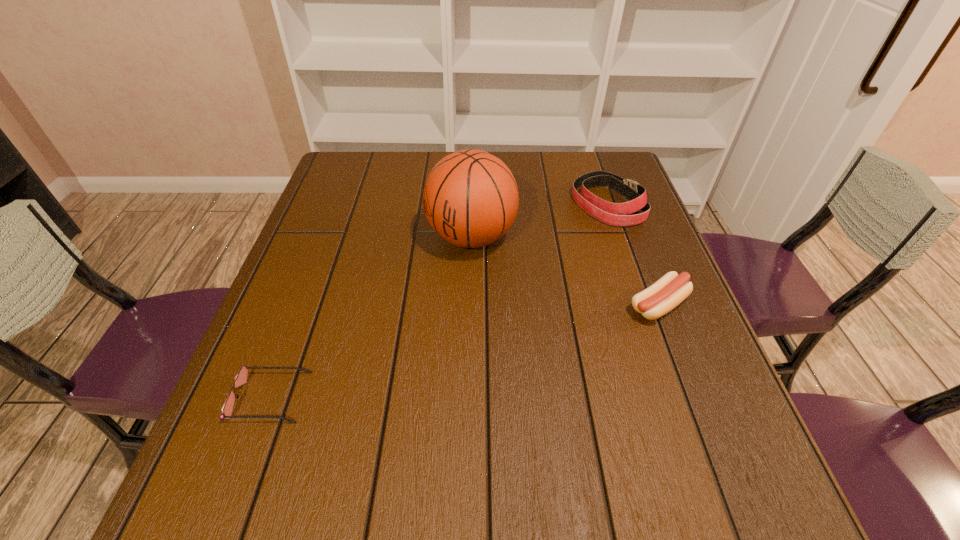
Identify the location of vacant space at the far right corner. Image resolution: width=960 pixels, height=540 pixels. (596, 166).

Where is `blank region between the third shortest object and the sausage`? Image resolution: width=960 pixels, height=540 pixels. blank region between the third shortest object and the sausage is located at coordinates (633, 255).

Find the location of a particular element. This screenshot has height=540, width=960. free space between the leftmost object and the dog collar is located at coordinates (439, 300).

The image size is (960, 540). I want to click on blank region between the shortest object and the second tallest object, so click(439, 300).

The image size is (960, 540). Identify the location of free space between the basketball and the second shortest object. (564, 271).

Locate an element on the screen. Image resolution: width=960 pixels, height=540 pixels. free space between the second nearest object and the nearest object is located at coordinates (465, 351).

You are a GUI agent. You are given a task and a screenshot of the screen. Output one action in this format:
    pyautogui.click(x=<x>, y=<y>)
    Task: Click on the vacant space that's between the dog collar and the sausage
    
    Given the screenshot: What is the action you would take?
    tap(633, 255)

Locate an element on the screen. This screenshot has height=540, width=960. free space between the sausage and the dog collar is located at coordinates (633, 255).

Where is `unoccupied position between the sunglasses and the third object from right to left`? unoccupied position between the sunglasses and the third object from right to left is located at coordinates point(371,317).

Find the location of `empty space that is in between the third object from right to left and the sausage`. empty space that is in between the third object from right to left and the sausage is located at coordinates (564, 271).